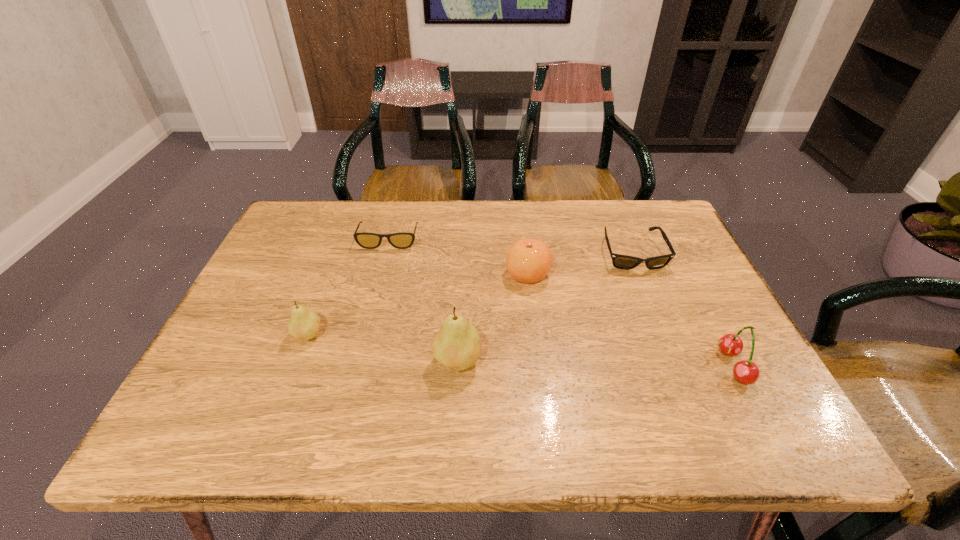
Please show where to add a pear on the right while keeping spacing even. Please provide its 2D coordinates. Your answer should be formatted as a tuple, i.e. [(x, y)], where the tuple contains the x and y coordinates of a point satisfying the conditions above.

[(625, 390)]